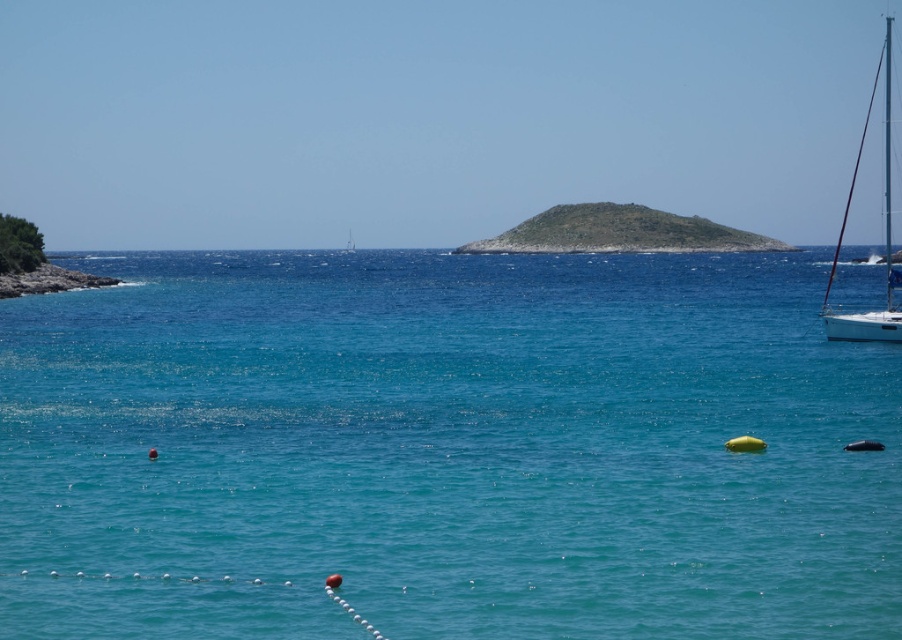
You are a sailor planning to dock your boat near the white glossy sailboat at right. Based on the scene, where would you position your boat relative to the clear blue water at center?

The clear blue water at center is located below the white glossy sailboat at right, so you should position your boat below the white glossy sailboat at right near the clear blue water at center to dock.

You are a sailor navigating a small boat in the coastal scene. You need to pass between the white glossy sailboat at right and the smooth stone cliff at lower left. Based on their positions, which direction should you steer your boat to avoid hitting either?

The white glossy sailboat at right is above the smooth stone cliff at lower left, so steering your boat towards the lower left direction would allow you to pass safely between them without collision.

You are standing on the smooth stone cliff at lower left and want to reach the green grassy island at center. Which direction should you walk to get there?

To reach the green grassy island at center from the smooth stone cliff at lower left, you should walk to the right since the green grassy island at center is located to the right of the smooth stone cliff at lower left.